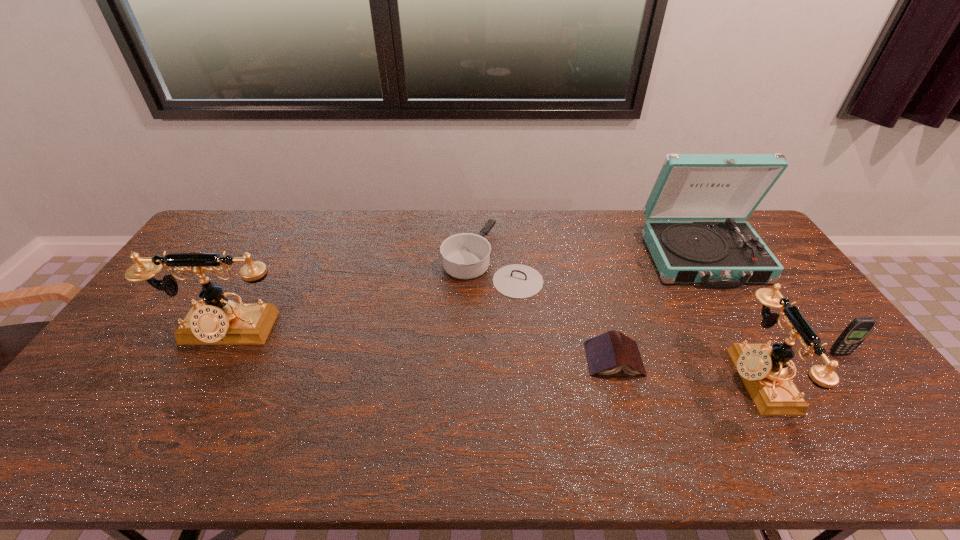
If equal spacing is the goal by inserting an additional telephone among them, please point out a vacant space for this new telephone. Please provide its 2D coordinates. Your answer should be formatted as a tuple, i.e. [(x, y)], where the tuple contains the x and y coordinates of a point satisfying the conditions above.

[(478, 354)]